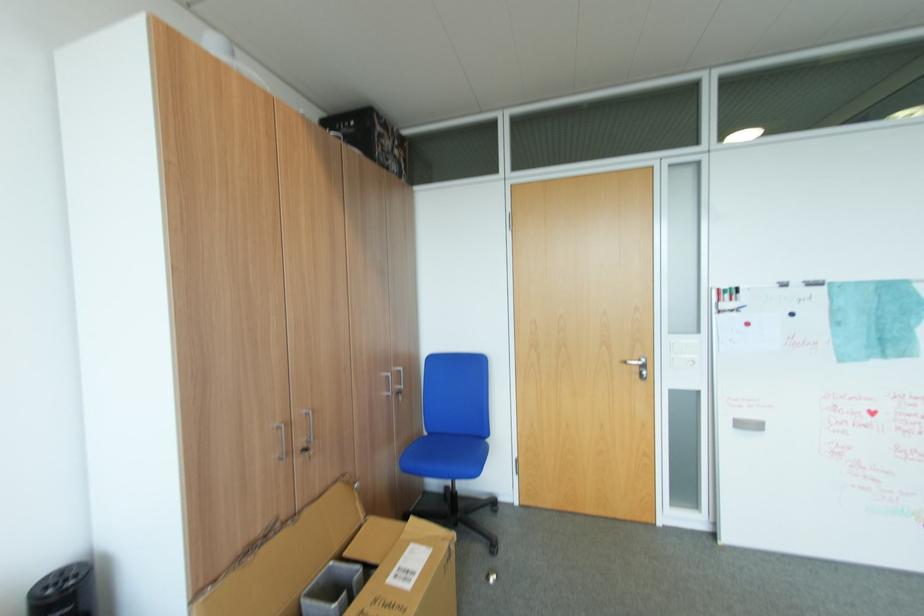
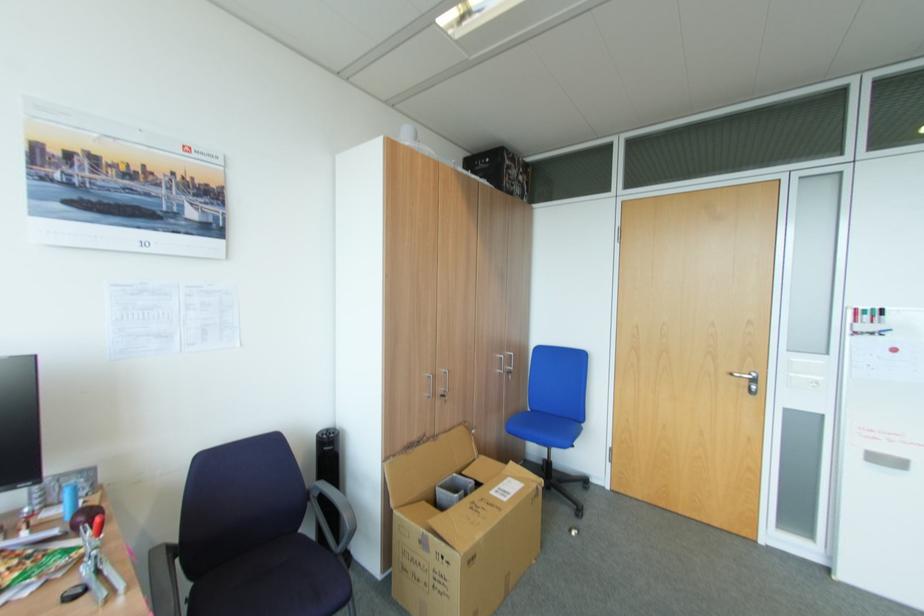
Locate, in the second image, the point that corresponds to (x=720, y=312) in the first image.

(856, 333)